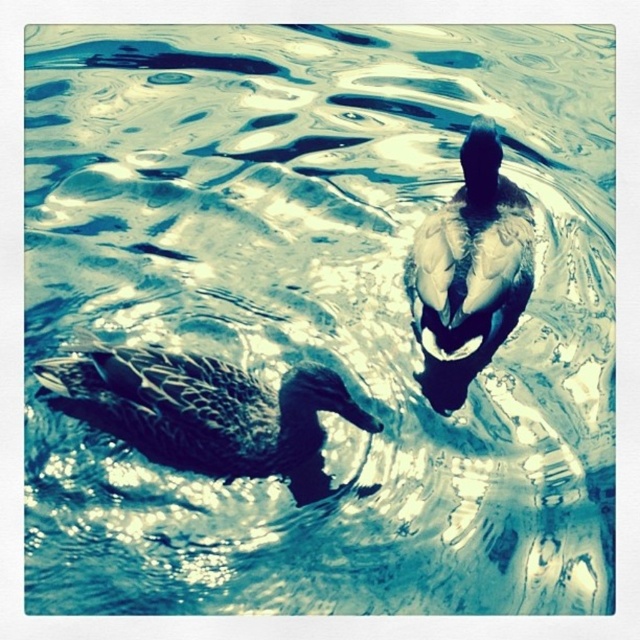
Question: From the image, what is the correct spatial relationship of dark brown feathers duck at lower left in relation to dark brown feathers at upper center?

Choices:
 (A) right
 (B) left

Answer: (B)

Question: Among these points, which one is farthest from the camera?

Choices:
 (A) (145, 433)
 (B) (465, 260)

Answer: (B)

Question: Which object appears farthest from the camera in this image?

Choices:
 (A) dark brown feathers at upper center
 (B) dark brown feathers duck at lower left

Answer: (A)

Question: Which of the following is the farthest from the observer?

Choices:
 (A) dark brown feathers duck at lower left
 (B) dark brown feathers at upper center

Answer: (B)

Question: Does dark brown feathers duck at lower left come behind dark brown feathers at upper center?

Choices:
 (A) yes
 (B) no

Answer: (B)

Question: Considering the relative positions of dark brown feathers duck at lower left and dark brown feathers at upper center in the image provided, where is dark brown feathers duck at lower left located with respect to dark brown feathers at upper center?

Choices:
 (A) above
 (B) below

Answer: (B)